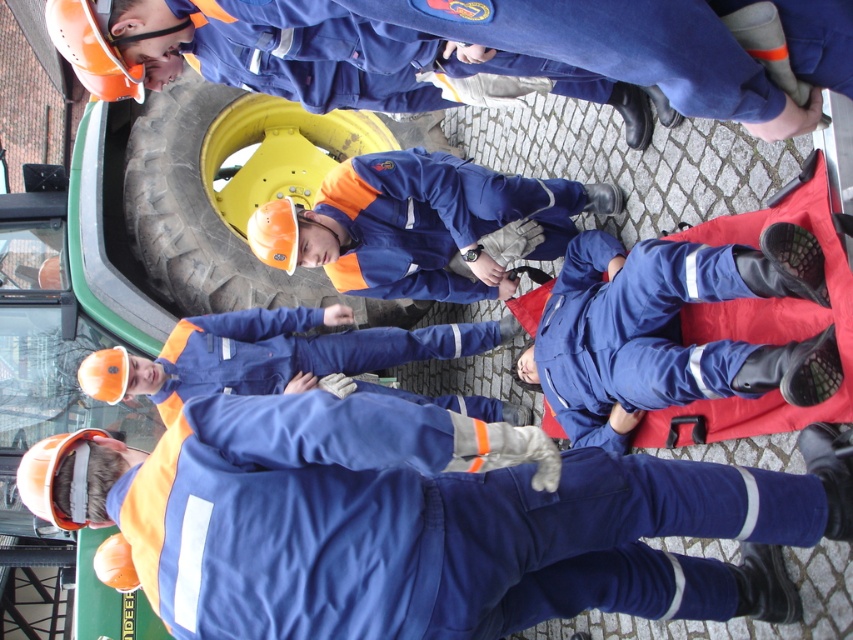
Does matte blue jumpsuit at center have a larger size compared to yellow rubber tire at center?

No, matte blue jumpsuit at center is not bigger than yellow rubber tire at center.

Consider the image. Does matte blue jumpsuit at center appear on the left side of yellow rubber tire at center?

In fact, matte blue jumpsuit at center is to the right of yellow rubber tire at center.

You are a GUI agent. You are given a task and a screenshot of the screen. Output one action in this format:
    pyautogui.click(x=<x>, y=<y>)
    Task: Click on the matte blue jumpsuit at center
    
    Given the screenshot: What is the action you would take?
    pyautogui.click(x=422, y=225)

Image resolution: width=853 pixels, height=640 pixels. I want to click on matte blue jumpsuit at center, so click(422, 225).